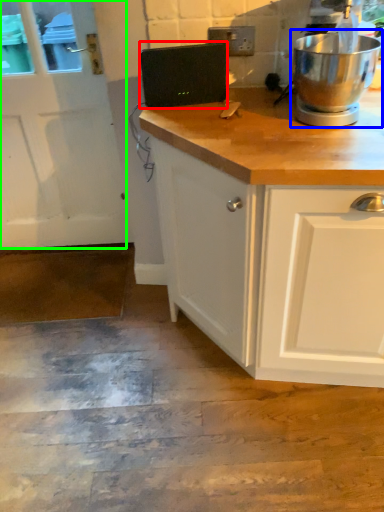
Question: Based on their relative distances, which object is nearer to appliance (highlighted by a red box)? Choose from home appliance (highlighted by a blue box) and screen door (highlighted by a green box).

Choices:
 (A) home appliance
 (B) screen door

Answer: (A)